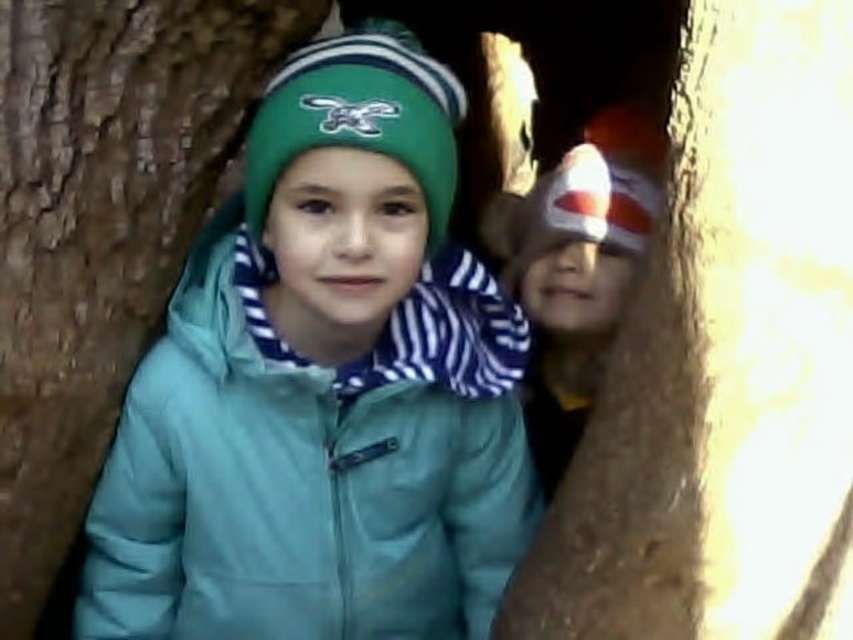
You are a photographer trying to capture both the brown rough bark at right and the teal matte jacket at center in the same frame. Given that your camera has a maximum focus range of 20 inches, will you be able to focus on both objects simultaneously?

The brown rough bark at right and teal matte jacket at center are 21.76 inches apart from each other. Since the distance between them exceeds the camera maximum focus range of 20 inches, you cannot focus on both objects simultaneously.

You are trying to determine which part of the tree is closer to you in the image. Based on the visibility of the brown rough bark at right and the brown rough tree trunk at left, which one is more prominent in the scene?

The brown rough tree trunk at left is more prominent in the scene because it occupies more space than the brown rough bark at right.